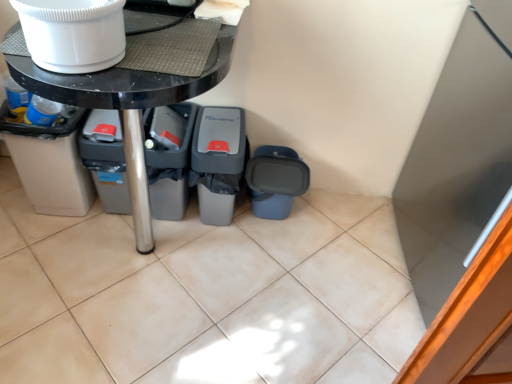
Measure the distance between black glossy table at center and camera.

black glossy table at center and camera are 32.06 inches apart.

The width and height of the screenshot is (512, 384). In order to click on gray plastic bin at lower left in this screenshot , I will do `click(168, 158)`.

In the scene shown: Measure the distance between gray plastic recycling bin at center, which is counted as the third recycling bin, starting from the right, and camera.

The depth of gray plastic recycling bin at center, which is counted as the third recycling bin, starting from the right, is 4.44 feet.

Where is `black glossy table at center`? black glossy table at center is located at coordinates pos(127,105).

Between point (505, 49) and point (303, 192), which one is positioned behind?

The point (303, 192) is behind.

Is white glossy refrigerator at upper right facing away from blue matte recycling bin at lower right, which is the 4th recycling bin in left-to-right order?

No.

Between white glossy refrigerator at upper right and blue matte recycling bin at lower right, which appears as the 1th recycling bin when viewed from the right, which one has more height?

white glossy refrigerator at upper right is taller.

Is white glossy toilet bowl at upper left to the left of white glossy refrigerator at upper right from the viewer's perspective?

Indeed, white glossy toilet bowl at upper left is positioned on the left side of white glossy refrigerator at upper right.

Which is correct: white glossy toilet bowl at upper left is inside white glossy refrigerator at upper right, or outside of it?

white glossy toilet bowl at upper left exists outside the volume of white glossy refrigerator at upper right.

Is beige plastic recycling bin at lower left, placed as the first recycling bin when sorted from left to right, far from black glossy table at center?

No, beige plastic recycling bin at lower left, placed as the first recycling bin when sorted from left to right, is not far away from black glossy table at center.

Is beige plastic recycling bin at lower left, placed as the first recycling bin when sorted from left to right, thinner than black glossy table at center?

Yes, beige plastic recycling bin at lower left, placed as the first recycling bin when sorted from left to right, is thinner than black glossy table at center.

Is beige plastic recycling bin at lower left, placed as the first recycling bin when sorted from left to right, aimed at black glossy table at center?

No.

Which object is positioned more to the left, beige plastic recycling bin at lower left, placed as the first recycling bin when sorted from left to right, or black glossy table at center?

beige plastic recycling bin at lower left, placed as the first recycling bin when sorted from left to right, is more to the left.

Between white glossy toilet bowl at upper left and blue matte recycling bin at lower right, which is the 4th recycling bin in left-to-right order, which one has larger size?

Bigger between the two is blue matte recycling bin at lower right, which is the 4th recycling bin in left-to-right order.

In terms of height, does white glossy toilet bowl at upper left look taller or shorter compared to blue matte recycling bin at lower right, which appears as the 1th recycling bin when viewed from the right?

white glossy toilet bowl at upper left is shorter than blue matte recycling bin at lower right, which appears as the 1th recycling bin when viewed from the right.

From a real-world perspective, which is physically below, white glossy toilet bowl at upper left or blue matte recycling bin at lower right, which is the 4th recycling bin in left-to-right order?

blue matte recycling bin at lower right, which is the 4th recycling bin in left-to-right order, from a real-world perspective.

Considering the relative positions of blue matte recycling bin at lower right, which appears as the 1th recycling bin when viewed from the right, and beige plastic recycling bin at lower left, placed as the first recycling bin when sorted from left to right, in the image provided, is blue matte recycling bin at lower right, which appears as the 1th recycling bin when viewed from the right, to the left or to the right of beige plastic recycling bin at lower left, placed as the first recycling bin when sorted from left to right,?

Result: Clearly, blue matte recycling bin at lower right, which appears as the 1th recycling bin when viewed from the right, is on the right of beige plastic recycling bin at lower left, placed as the first recycling bin when sorted from left to right, in the image.

Is beige plastic recycling bin at lower left, placed as the 4th recycling bin when sorted from right to left, at the back of blue matte recycling bin at lower right, which is the 4th recycling bin in left-to-right order?

No, blue matte recycling bin at lower right, which is the 4th recycling bin in left-to-right order, is not facing the opposite direction of beige plastic recycling bin at lower left, placed as the 4th recycling bin when sorted from right to left.

What's the angular difference between blue matte recycling bin at lower right, which is the 4th recycling bin in left-to-right order, and beige plastic recycling bin at lower left, placed as the 4th recycling bin when sorted from right to left,'s facing directions?

0.446 degrees.

From a real-world perspective, between blue matte recycling bin at lower right, which is the 4th recycling bin in left-to-right order, and beige plastic recycling bin at lower left, placed as the first recycling bin when sorted from left to right, who is vertically lower?

blue matte recycling bin at lower right, which is the 4th recycling bin in left-to-right order, is physically lower.

How many degrees apart are the facing directions of black glossy table at center and gray plastic recycling bin at center, placed as the second recycling bin when sorted from left to right?

2.09 degrees.

Considering the sizes of objects black glossy table at center and gray plastic recycling bin at center, which is counted as the third recycling bin, starting from the right, in the image provided, who is taller, black glossy table at center or gray plastic recycling bin at center, which is counted as the third recycling bin, starting from the right,?

black glossy table at center is taller.

Is black glossy table at center inside the boundaries of gray plastic recycling bin at center, which is counted as the third recycling bin, starting from the right, or outside?

black glossy table at center is located beyond the bounds of gray plastic recycling bin at center, which is counted as the third recycling bin, starting from the right.

Is point (166, 121) farther from camera compared to point (463, 143)?

That is False.

Is gray plastic recycling bin at center, placed as the second recycling bin when sorted from left to right, touching white glossy refrigerator at upper right?

gray plastic recycling bin at center, placed as the second recycling bin when sorted from left to right, and white glossy refrigerator at upper right are not in contact.

From a real-world perspective, who is located higher, gray plastic recycling bin at center, which is counted as the third recycling bin, starting from the right, or white glossy refrigerator at upper right?

In real-world perspective, white glossy refrigerator at upper right is above.

Image resolution: width=512 pixels, height=384 pixels. What are the coordinates of `appliance that appears above the blue matte recycling bin at lower right, which is the 4th recycling bin in left-to-right order (from a real-world perspective)` in the screenshot? It's located at (458, 157).

Where is `appliance below the white glossy toilet bowl at upper left (from the image's perspective)`? The image size is (512, 384). appliance below the white glossy toilet bowl at upper left (from the image's perspective) is located at coordinates (458, 157).

Which object lies nearer to the anchor point white glossy refrigerator at upper right, black glossy table at center or blue matte recycling bin at lower right, which is the 4th recycling bin in left-to-right order?

blue matte recycling bin at lower right, which is the 4th recycling bin in left-to-right order, is positioned closer to the anchor white glossy refrigerator at upper right.

Estimate the real-world distances between objects in this image. Which object is closer to gray plastic recycling bin at center, which is the second recycling bin from right to left, beige plastic recycling bin at lower left, placed as the first recycling bin when sorted from left to right, or gray plastic recycling bin at center, placed as the second recycling bin when sorted from left to right?

gray plastic recycling bin at center, placed as the second recycling bin when sorted from left to right, is positioned closer to the anchor gray plastic recycling bin at center, which is the second recycling bin from right to left.

Looking at the image, which one is located closer to white glossy refrigerator at upper right, black glossy table at center or gray plastic recycling bin at center, placed as the second recycling bin when sorted from left to right?

Among the two, gray plastic recycling bin at center, placed as the second recycling bin when sorted from left to right, is located nearer to white glossy refrigerator at upper right.

When comparing their distances from blue matte recycling bin at lower right, which appears as the 1th recycling bin when viewed from the right, does gray plastic recycling bin at center, which is the second recycling bin from right to left, or black glossy table at center seem closer?

The object closer to blue matte recycling bin at lower right, which appears as the 1th recycling bin when viewed from the right, is gray plastic recycling bin at center, which is the second recycling bin from right to left.

From the image, which object appears to be farther from blue matte recycling bin at lower right, which appears as the 1th recycling bin when viewed from the right, beige plastic recycling bin at lower left, placed as the 4th recycling bin when sorted from right to left, or gray plastic recycling bin at center, which is the second recycling bin from right to left?

beige plastic recycling bin at lower left, placed as the 4th recycling bin when sorted from right to left, lies further to blue matte recycling bin at lower right, which appears as the 1th recycling bin when viewed from the right, than the other object.

Which object lies nearer to the anchor point beige plastic recycling bin at lower left, placed as the 4th recycling bin when sorted from right to left, white glossy toilet bowl at upper left or gray plastic recycling bin at center, which is the second recycling bin from right to left?

The object closer to beige plastic recycling bin at lower left, placed as the 4th recycling bin when sorted from right to left, is gray plastic recycling bin at center, which is the second recycling bin from right to left.

Estimate the real-world distances between objects in this image. Which object is closer to black glossy table at center, white glossy refrigerator at upper right or blue matte recycling bin at lower right, which appears as the 1th recycling bin when viewed from the right?

The object closer to black glossy table at center is blue matte recycling bin at lower right, which appears as the 1th recycling bin when viewed from the right.

Considering their positions, is beige plastic recycling bin at lower left, placed as the first recycling bin when sorted from left to right, positioned closer to black glossy table at center than white glossy toilet bowl at upper left?

white glossy toilet bowl at upper left is positioned closer to the anchor black glossy table at center.

You are a GUI agent. You are given a task and a screenshot of the screen. Output one action in this format:
    pyautogui.click(x=<x>, y=<y>)
    Task: Click on the bin located between black glossy table at center and gray plastic recycling bin at center, marked as the 3th recycling bin in a left-to-right arrangement, in the depth direction
    The width and height of the screenshot is (512, 384).
    Given the screenshot: What is the action you would take?
    pyautogui.click(x=168, y=158)

This screenshot has width=512, height=384. Find the location of `bin between beige plastic recycling bin at lower left, placed as the 4th recycling bin when sorted from right to left, and gray plastic recycling bin at center, which is counted as the third recycling bin, starting from the right, from left to right`. bin between beige plastic recycling bin at lower left, placed as the 4th recycling bin when sorted from right to left, and gray plastic recycling bin at center, which is counted as the third recycling bin, starting from the right, from left to right is located at coordinates point(168,158).

Image resolution: width=512 pixels, height=384 pixels. I want to click on table between white glossy toilet bowl at upper left and gray plastic recycling bin at center, placed as the second recycling bin when sorted from left to right, along the z-axis, so click(127, 105).

Identify the location of recycling bin located between gray plastic recycling bin at center, which is counted as the third recycling bin, starting from the right, and blue matte recycling bin at lower right, which is the 4th recycling bin in left-to-right order, in the left-right direction. The width and height of the screenshot is (512, 384). (218, 161).